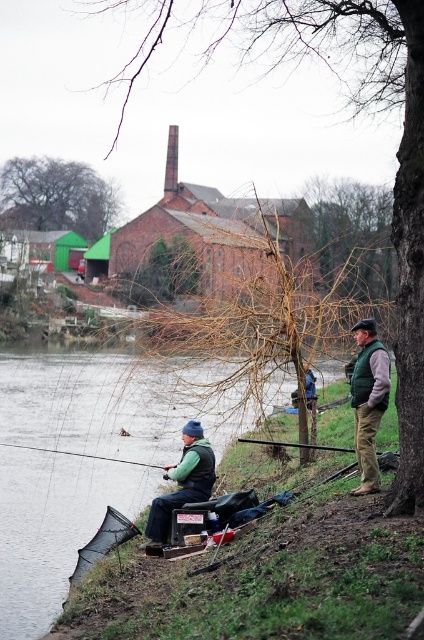
You are a photographer trying to capture the scene of the matte green vest at center and the smooth black rod at lower center. Which object should you focus on first if you want to ensure both are in frame without moving the camera?

The matte green vest at center is much taller than the smooth black rod at lower center, so focusing on the taller object first would help ensure both are in frame.

You are standing at the point labeled as point (245, 436) and want to move towards the point labeled as point (195, 484). Which direction should you move relative to your current position?

You should move forward because point (195, 484) is in front of point (245, 436).